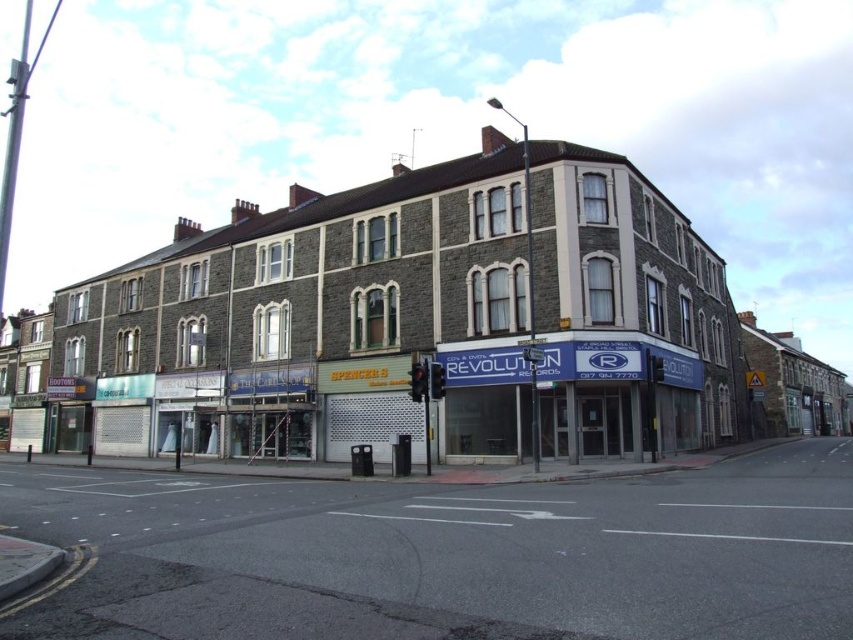
Based on the photo, is stone building at center to the right of gray concrete road at center from the viewer's perspective?

In fact, stone building at center is to the left of gray concrete road at center.

Is stone building at center further to the viewer compared to gray concrete road at center?

Yes, stone building at center is further from the viewer.

This screenshot has height=640, width=853. In order to click on stone building at center in this screenshot , I will do `click(413, 317)`.

Locate an element on the screen. This screenshot has height=640, width=853. stone building at center is located at coordinates (413, 317).

Can you confirm if stone building at center is positioned below blue matte signboard at center?

Actually, stone building at center is above blue matte signboard at center.

Does point (418, 227) lie behind point (625, 380)?

Yes, it is behind point (625, 380).

Locate an element on the screen. Image resolution: width=853 pixels, height=640 pixels. stone building at center is located at coordinates (413, 317).

Which is behind, point (762, 627) or point (604, 352)?

The point (604, 352) is more distant.

How distant is gray concrete road at center from blue matte signboard at center?

gray concrete road at center and blue matte signboard at center are 13.47 meters apart.

Image resolution: width=853 pixels, height=640 pixels. I want to click on gray concrete road at center, so click(x=447, y=554).

Locate an element on the screen. Image resolution: width=853 pixels, height=640 pixels. gray concrete road at center is located at coordinates (447, 554).